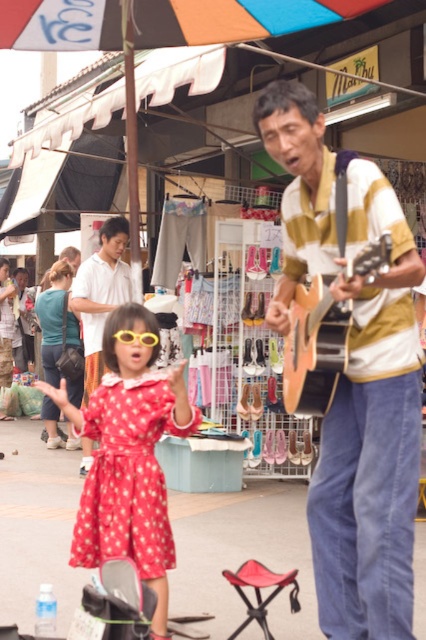
Question: Which object is closer to the camera taking this photo?

Choices:
 (A) polka dot fabric dress at lower left
 (B) yellow plastic goggles at center
 (C) matte white shirt at upper left

Answer: (A)

Question: Which object is positioned closest to the red fabric stool at lower center?

Choices:
 (A) polka dot fabric dress at lower left
 (B) red polka dot fabric dress at center

Answer: (B)

Question: Where is red polka dot fabric dress at center located in relation to matte white shirt at upper left in the image?

Choices:
 (A) left
 (B) right

Answer: (B)

Question: Which of the following is the closest to the observer?

Choices:
 (A) (94, 360)
 (B) (94, 541)
 (C) (327, 284)
 (D) (256, 566)

Answer: (C)

Question: Is wooden acoustic guitar at center to the right of matte white shirt at upper left from the viewer's perspective?

Choices:
 (A) yes
 (B) no

Answer: (A)

Question: Is red polka dot fabric dress at center smaller than yellow plastic goggles at center?

Choices:
 (A) yes
 (B) no

Answer: (B)